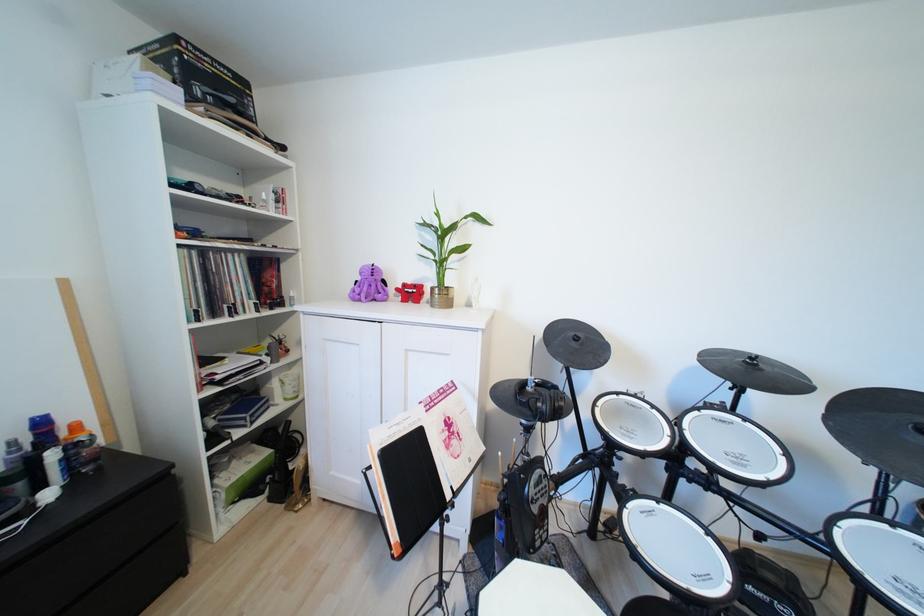
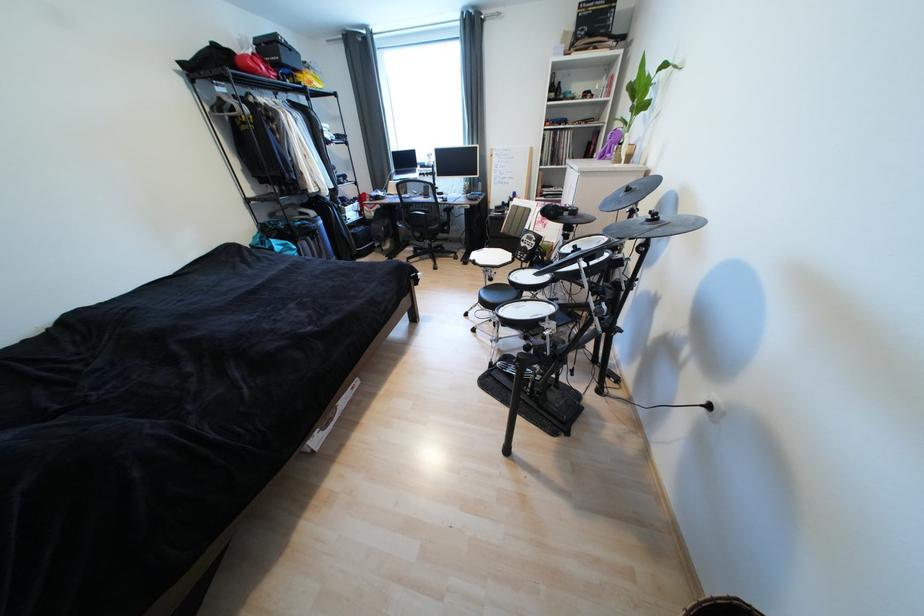
Find the pixel in the second image that matches (580,346) in the first image.

(628, 196)